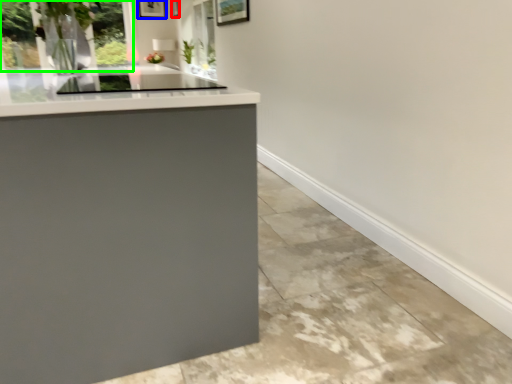
Question: Which object is positioned farthest from picture frame (highlighted by a red box)? Select from picture frame (highlighted by a blue box) and window (highlighted by a green box).

Choices:
 (A) picture frame
 (B) window

Answer: (B)